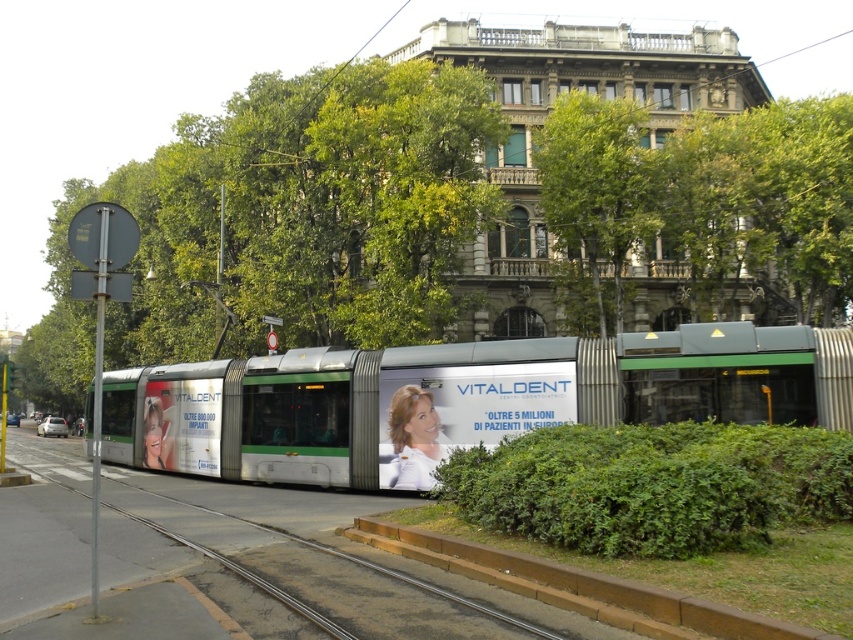
Question: Does green metallic tram at center have a lesser width compared to metal train track at center?

Choices:
 (A) no
 (B) yes

Answer: (A)

Question: Which point is farther to the camera?

Choices:
 (A) green metallic tram at center
 (B) metal train track at center

Answer: (A)

Question: Can you confirm if green metallic tram at center is positioned above metal train track at center?

Choices:
 (A) yes
 (B) no

Answer: (A)

Question: Does green metallic tram at center have a smaller size compared to metal train track at center?

Choices:
 (A) yes
 (B) no

Answer: (B)

Question: Which point is closer to the camera?

Choices:
 (A) metal train track at center
 (B) green metallic tram at center

Answer: (A)

Question: Which object is farther from the camera taking this photo?

Choices:
 (A) green metallic tram at center
 (B) metal train track at center

Answer: (A)